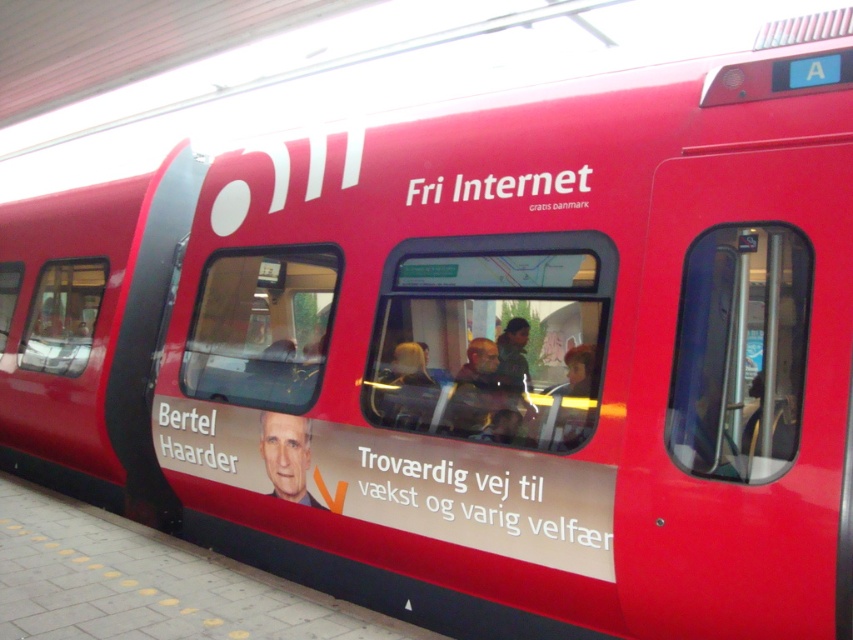
Looking at the advertisement on the red train, which object is wider between the smooth skin portrait at center and the smooth brown hair at center?

The smooth skin portrait at center is wider than the smooth brown hair at center.